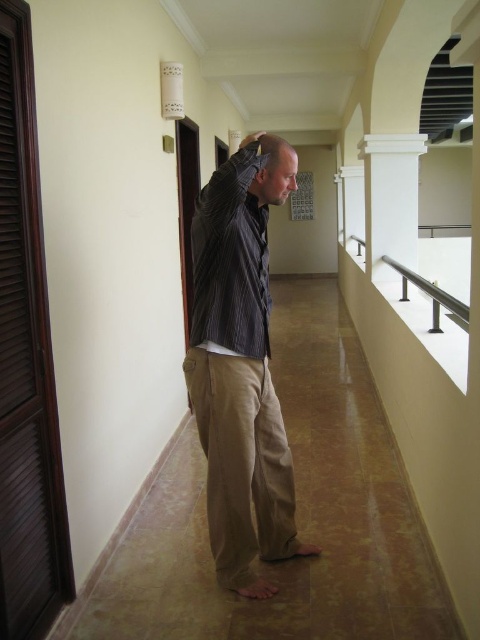
The man in the corridor has light brown hair at center and is near a satin silver railing at right. Which object has a greater width?

The satin silver railing at right has a greater width than the light brown hair at center.

You are a delivery person who needs to deliver a package to the man in the corridor. You are currently at the entrance of the corridor. The entrance is located at the bottom of the corridor. The man is standing at point (240, 365). You want to know if you can approach him directly from the entrance without any obstacles. Is there any object between you and the man?

The striped fabric shirt at center is located at point (240, 365) where the man is standing. Since the man is the only object mentioned in the scene, there are no obstacles between you and him, so you can approach him directly.